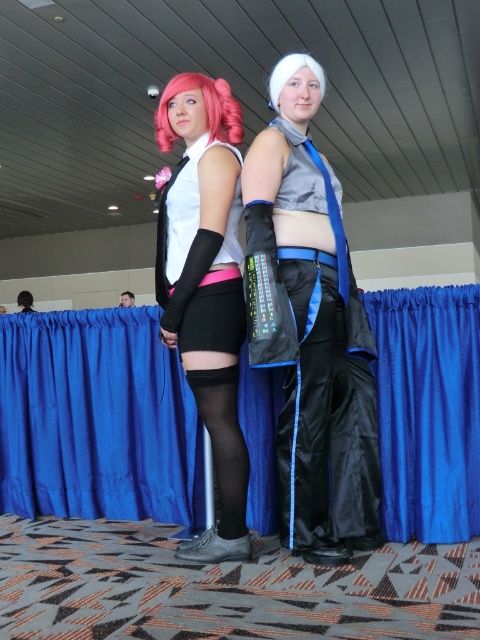
You are a photographer setting up for a photoshoot in the convention space. You need to ensure that the matte black skirt at center and the black satin pants at center are both visible in the frame. Given that the skirt is larger, which clothing item should you focus on positioning first to ensure it doesn

The matte black skirt at center is bigger than the black satin pants at center, so you should position the matte black skirt at center first to ensure it fits within the frame.

Based on the scene description, can you determine which object is positioned higher between the matte black skirt at center and the matte black arm guard at center?

The matte black arm guard at center is positioned higher than the matte black skirt at center.